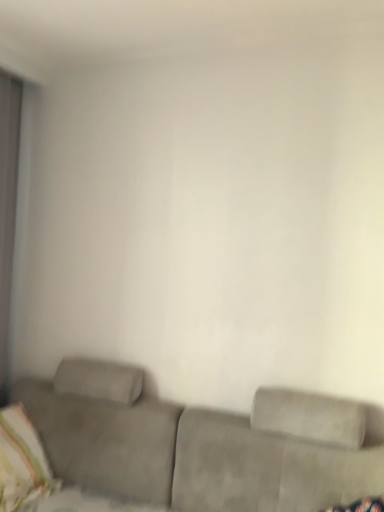
Question: Would you say striped fabric pillow at lower left is inside or outside suede couch at lower center?

Choices:
 (A) inside
 (B) outside

Answer: (A)

Question: Would you say striped fabric pillow at lower left is to the left or to the right of suede couch at lower center in the picture?

Choices:
 (A) left
 (B) right

Answer: (A)

Question: From the image's perspective, relative to suede couch at lower center, is striped fabric pillow at lower left above or below?

Choices:
 (A) below
 (B) above

Answer: (B)

Question: Based on their positions, is suede couch at lower center located to the left or right of striped fabric pillow at lower left?

Choices:
 (A) left
 (B) right

Answer: (B)

Question: Is suede couch at lower center in front of or behind striped fabric pillow at lower left in the image?

Choices:
 (A) behind
 (B) front

Answer: (B)

Question: Is suede couch at lower center situated inside striped fabric pillow at lower left or outside?

Choices:
 (A) outside
 (B) inside

Answer: (A)

Question: From the image's perspective, relative to striped fabric pillow at lower left, is suede couch at lower center above or below?

Choices:
 (A) above
 (B) below

Answer: (B)